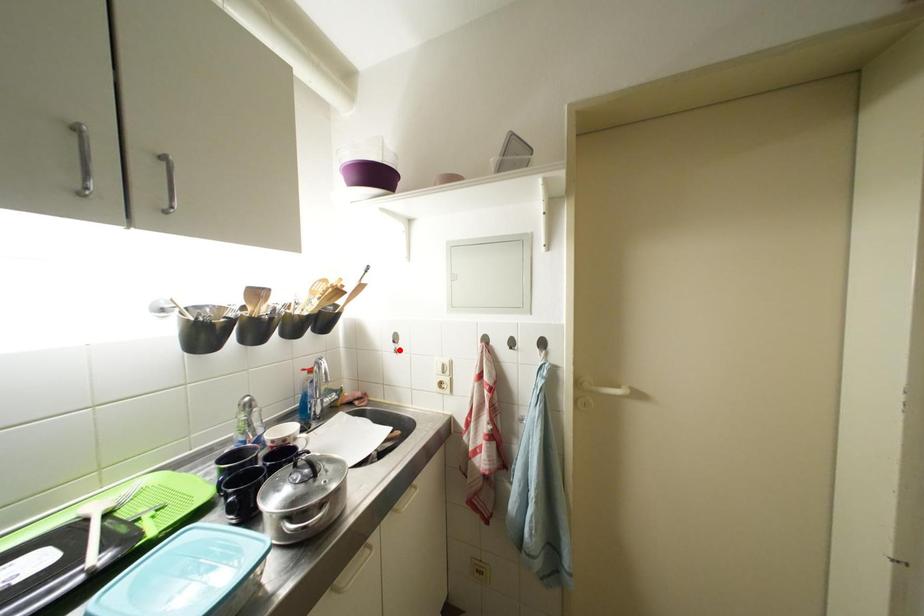
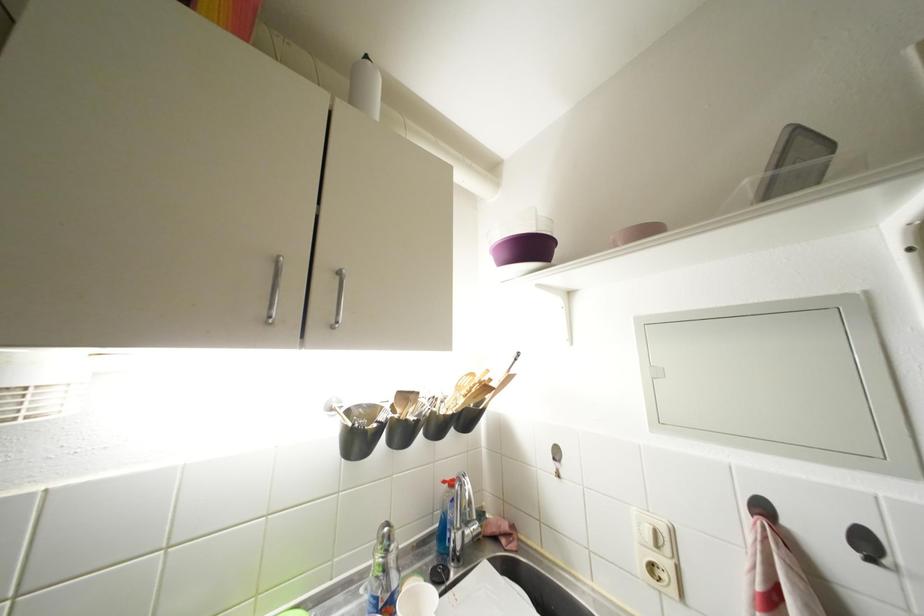
The point at the highlighted location is marked in the first image. Where is the corresponding point in the second image?

(560, 469)